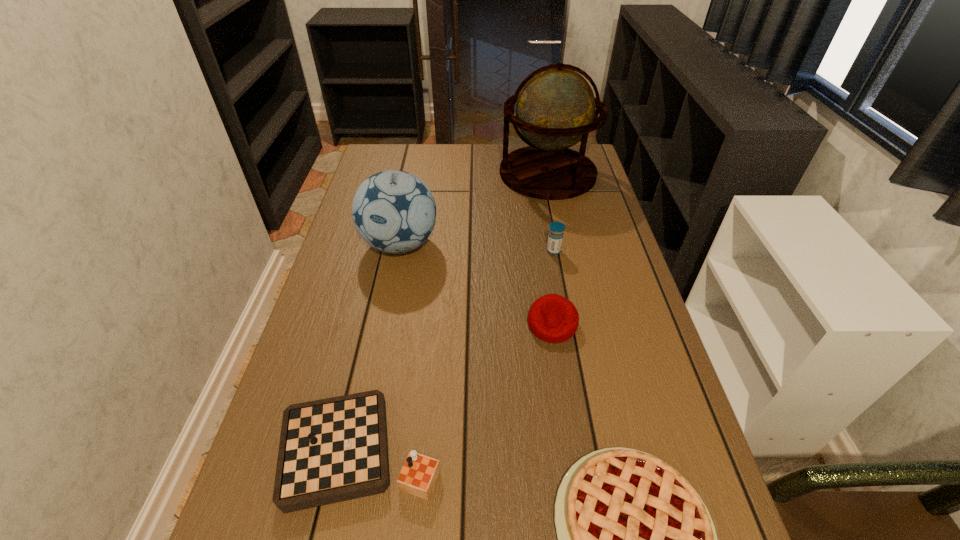
Find the location of `object that is the fifth closest to the chessboard`. object that is the fifth closest to the chessboard is located at coordinates (555, 109).

Choose which object is the fourth nearest neighbor to the chessboard. Please provide its 2D coordinates. Your answer should be formatted as a tuple, i.e. [(x, y)], where the tuple contains the x and y coordinates of a point satisfying the conditions above.

[(555, 238)]

Where is `vacant space that satisfies the following two spatial constraints: 1. on the side with brand of the chessboard; 2. on the right side of the soccer ball`? vacant space that satisfies the following two spatial constraints: 1. on the side with brand of the chessboard; 2. on the right side of the soccer ball is located at coordinates (358, 450).

Locate an element on the screen. This screenshot has height=540, width=960. free spot that satisfies the following two spatial constraints: 1. on the side with brand of the fifth shortest object; 2. on the left side of the chessboard is located at coordinates (358, 450).

Find the location of a particular element. The width and height of the screenshot is (960, 540). vacant area in the image that satisfies the following two spatial constraints: 1. on the front-facing side of the globe; 2. on the side with brand of the soccer ball is located at coordinates (563, 244).

I want to click on vacant area that satisfies the following two spatial constraints: 1. on the side with brand of the chessboard; 2. on the right side of the fifth shortest object, so click(x=358, y=450).

Locate an element on the screen. Image resolution: width=960 pixels, height=540 pixels. free space that satisfies the following two spatial constraints: 1. on the front-facing side of the farthest object; 2. on the side with brand of the fifth shortest object is located at coordinates (563, 244).

Where is `vacant point that satisfies the following two spatial constraints: 1. on the side with brand of the third tallest object; 2. on the left side of the soccer ball`? This screenshot has width=960, height=540. vacant point that satisfies the following two spatial constraints: 1. on the side with brand of the third tallest object; 2. on the left side of the soccer ball is located at coordinates (398, 251).

At what (x,y) coordinates should I click in order to perform the action: click on free location that satisfies the following two spatial constraints: 1. on the side with brand of the soccer ball; 2. on the left side of the chessboard. Please return your answer as a coordinate pair (x, y). Looking at the image, I should click on pos(358,450).